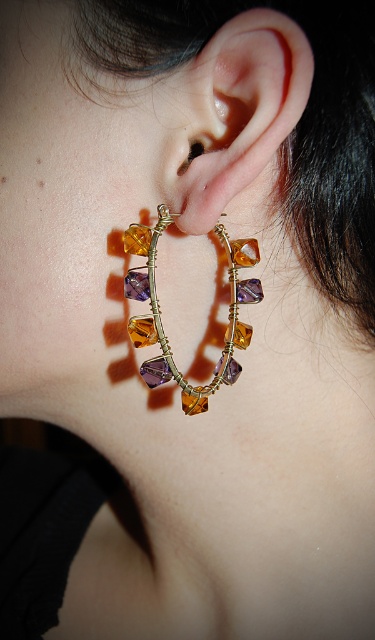
You are a jeweler examining the earrings from the image. You need to determine which of the two points, point [243,22] or point [142,234], is closer to the viewer. Based on the description, which point is closer?

Point [243,22] is closer to the viewer than point [142,234].

You are a jeweler examining a pair of hoop earrings. The clear crystal earring at center is located at point (249, 108). Can you determine the position of the clear crystal earring at center relative to the other hoop earring?

The clear crystal earring at center is located at point (249, 108), which is the central position of the hoop earrings. The other hoop earring would be positioned symmetrically opposite to it.